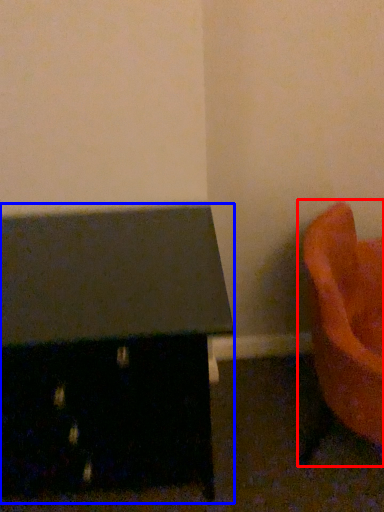
Question: Which object appears closest to the camera in this image, furniture (highlighted by a red box) or furniture (highlighted by a blue box)?

Choices:
 (A) furniture
 (B) furniture

Answer: (A)